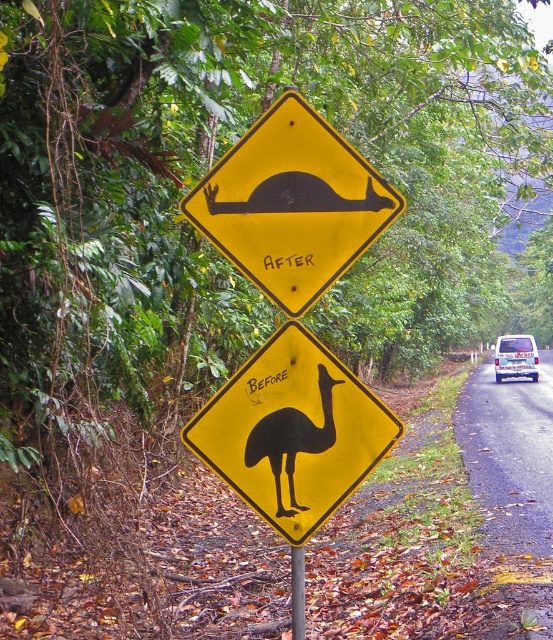
Question: Which of these objects is positioned farthest from the metallic gray pole at center?

Choices:
 (A) black rubber kangaroo at center
 (B) white plastic van at right
 (C) yellow matte/black textured bird at center

Answer: (B)

Question: Among these objects, which one is farthest from the camera?

Choices:
 (A) yellow matte/black silhouette at center
 (B) white plastic van at right

Answer: (B)

Question: Among these objects, which one is farthest from the camera?

Choices:
 (A) black rubber kangaroo at center
 (B) white plastic van at right

Answer: (B)

Question: Is yellow matte/black textured bird at center positioned behind black matte ostrich at center?

Choices:
 (A) no
 (B) yes

Answer: (A)

Question: Does black matte ostrich at center have a lesser width compared to black rubber kangaroo at center?

Choices:
 (A) no
 (B) yes

Answer: (B)

Question: Can you confirm if black matte ostrich at center is positioned to the left of metallic gray pole at center?

Choices:
 (A) yes
 (B) no

Answer: (A)